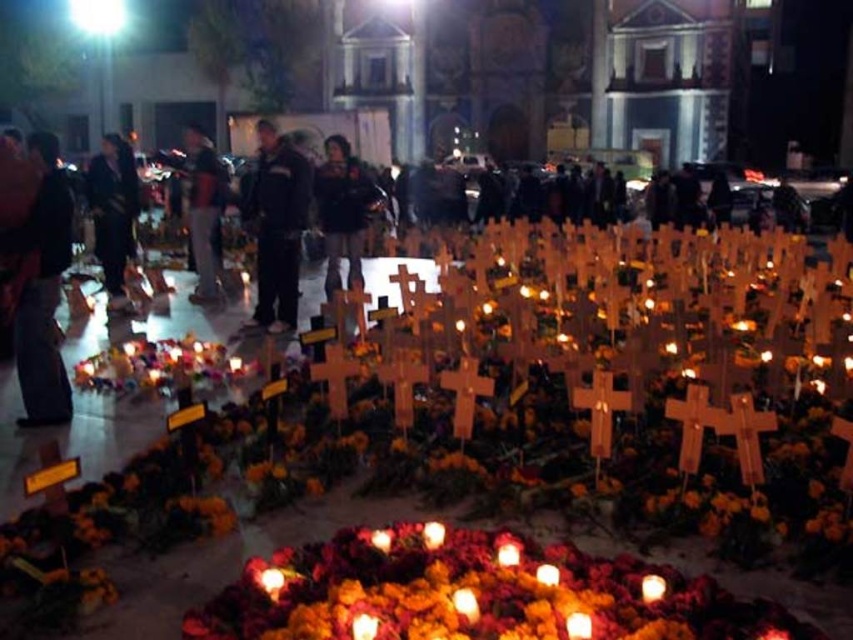
Question: Is black leather jacket at center wider than dark brown leather jacket at center?

Choices:
 (A) no
 (B) yes

Answer: (B)

Question: Which is nearer to the dark brown leather jacket at center?

Choices:
 (A) yellow matte cross at center
 (B) dark blue jeans at left
 (C) black leather jacket at center

Answer: (C)

Question: Is floral wreath at center further to the viewer compared to dark blue jacket at left?

Choices:
 (A) yes
 (B) no

Answer: (B)

Question: Which point is farther from the camera taking this photo?

Choices:
 (A) (294, 282)
 (B) (778, 435)
 (C) (320, 193)

Answer: (C)

Question: Is the position of yellow matte cross at center more distant than that of floral wreath at center?

Choices:
 (A) no
 (B) yes

Answer: (B)

Question: Which object is farther from the camera taking this photo?

Choices:
 (A) floral wreath at center
 (B) dark blue jeans at left
 (C) dark blue jacket at left
 (D) dark blue jeans at center

Answer: (D)